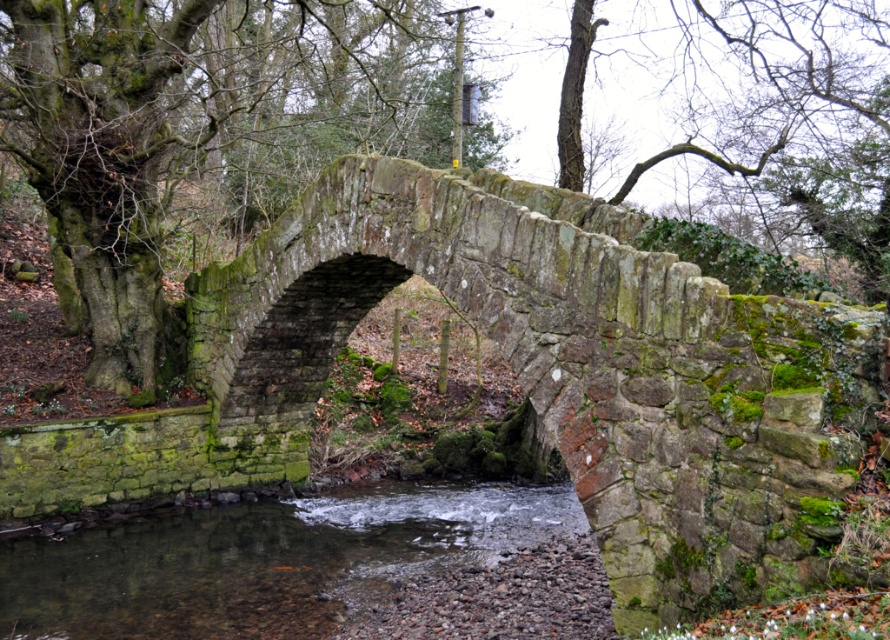
Question: Which point appears farthest from the camera in this image?

Choices:
 (A) (309, 612)
 (B) (298, 129)

Answer: (B)

Question: Does green mossy stone bridge at center have a lesser width compared to green mossy tree at center?

Choices:
 (A) no
 (B) yes

Answer: (B)

Question: Estimate the real-world distances between objects in this image. Which object is farther from the green mossy stone bridge at center?

Choices:
 (A) green mossy tree at center
 (B) clear water at stream center

Answer: (A)

Question: Which point is closer to the camera?

Choices:
 (A) (292, 548)
 (B) (484, 92)

Answer: (A)

Question: Does green mossy stone bridge at center lie in front of green mossy tree at center?

Choices:
 (A) yes
 (B) no

Answer: (A)

Question: Is green mossy tree at center wider than clear water at stream center?

Choices:
 (A) yes
 (B) no

Answer: (A)